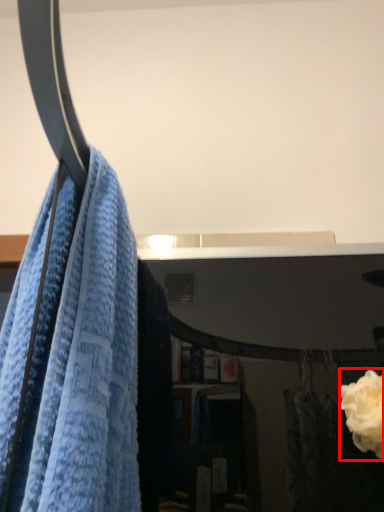
Question: In this image, where is rose (annotated by the red box) located relative to towel?

Choices:
 (A) left
 (B) right

Answer: (B)